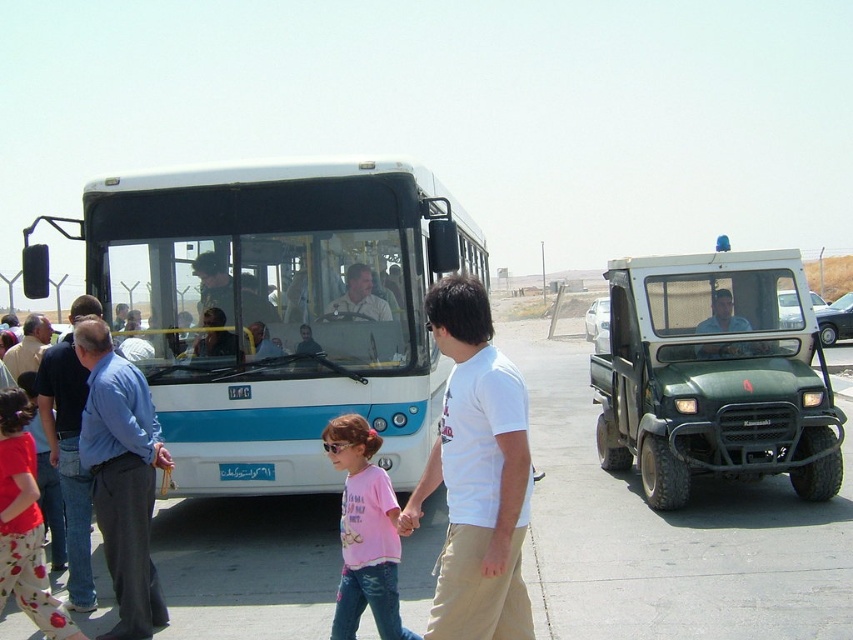
You are standing at the bus stop and want to check your phone. You have two shirts in view, the blue cotton shirt at left and the matte black shirt at center. Which shirt is closer to the ground?

The blue cotton shirt at left is located below the matte black shirt at center, so it is closer to the ground.

You are standing at the bus stop and notice two people wearing shirts. One is wearing a blue shirt at left and the other a matte white shirt at center. Which shirt appears narrower?

The blue shirt at left appears narrower than the matte white shirt at center as it has a lesser width.

You are standing at the bus stop and notice two people waiting for the bus. One is wearing a blue shirt at left, and the other is wearing a matte white shirt at center. From your perspective, which shirt is positioned to the left?

The blue shirt at left is positioned to the left of the matte white shirt at center.